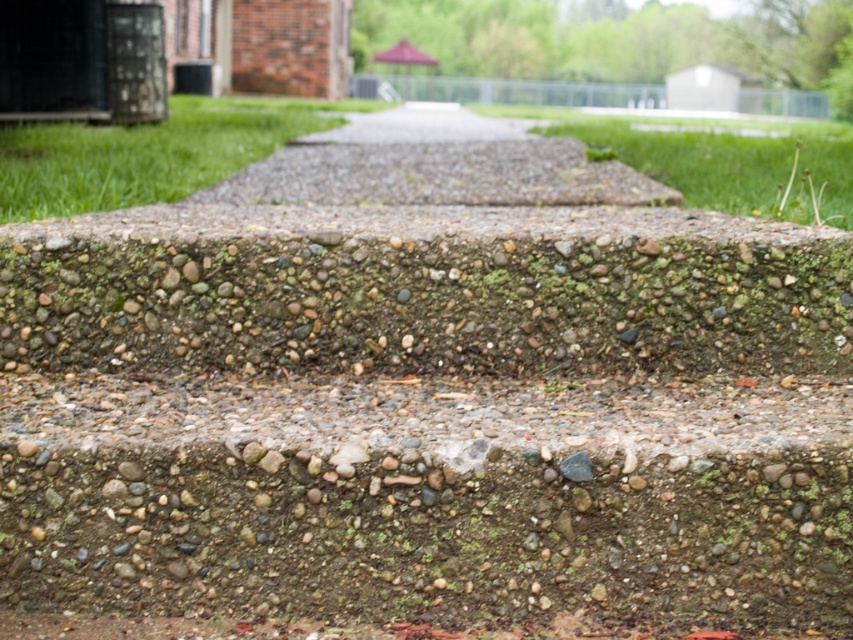
Is green grass at upper left above pebble concrete pavement at center?

Actually, green grass at upper left is below pebble concrete pavement at center.

Between point (177, 113) and point (384, 129), which one is positioned behind?

The point (177, 113) is more distant.

Is point (332, 116) behind point (422, 106)?

No, it is in front of (422, 106).

Find the location of a particular element. The width and height of the screenshot is (853, 640). green grass at upper left is located at coordinates (148, 152).

Does green grass at center appear on the left side of pebble concrete pavement at center?

In fact, green grass at center is to the right of pebble concrete pavement at center.

Who is more forward, (820, 157) or (473, 120)?

Point (820, 157) is more forward.

Find the location of a particular element. green grass at center is located at coordinates (718, 157).

Can you confirm if green grass at upper left is positioned below green grass at center?

Incorrect, green grass at upper left is not positioned below green grass at center.

Who is taller, green grass at upper left or green grass at center?

Standing taller between the two is green grass at upper left.

This screenshot has height=640, width=853. What are the coordinates of `green grass at upper left` in the screenshot? It's located at (148, 152).